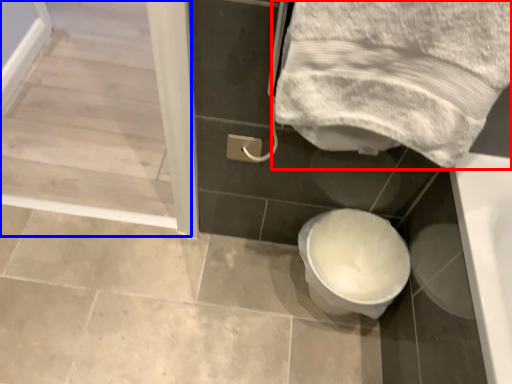
Question: Which object is closer to the camera taking this photo, towel (highlighted by a red box) or screen door (highlighted by a blue box)?

Choices:
 (A) towel
 (B) screen door

Answer: (A)